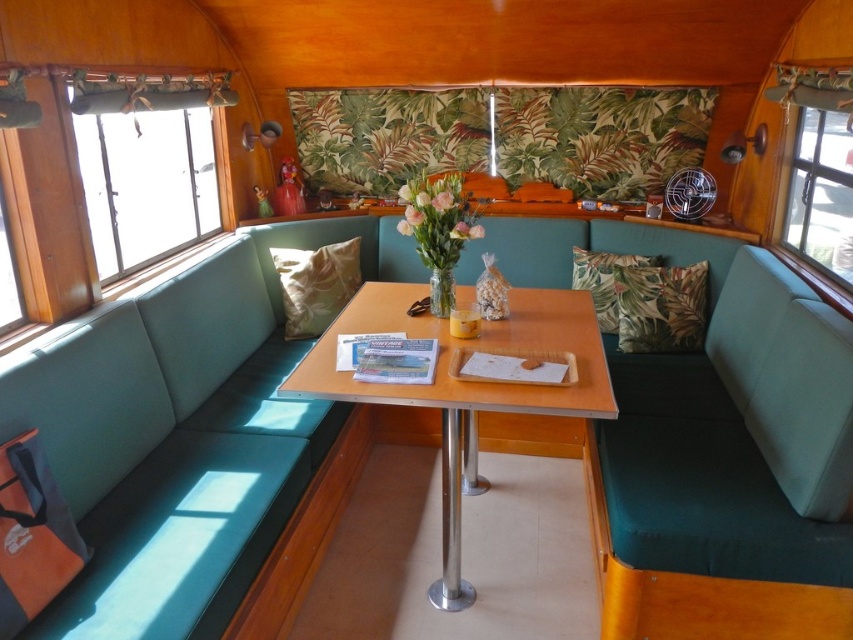
Does teal fabric couch at left have a lesser width compared to translucent glass vase at center?

No.

Is teal fabric couch at left further to the viewer compared to translucent glass vase at center?

No.

Does point (149, 573) lie in front of point (416, 225)?

Yes, point (149, 573) is in front of point (416, 225).

Find the location of a particular element. teal fabric couch at left is located at coordinates (178, 438).

Who is positioned more to the left, wooden table at center or green fabric pillow at center?

Positioned to the left is green fabric pillow at center.

Who is taller, wooden table at center or green fabric pillow at center?

With more height is wooden table at center.

The image size is (853, 640). What are the coordinates of `wooden table at center` in the screenshot? It's located at (466, 384).

Does point (573, 280) come closer to viewer compared to point (442, 300)?

No, (573, 280) is behind (442, 300).

Is floral fabric pillow at center positioned in front of clear glass vase at center?

No, floral fabric pillow at center is behind clear glass vase at center.

The width and height of the screenshot is (853, 640). What do you see at coordinates (604, 280) in the screenshot? I see `floral fabric pillow at center` at bounding box center [604, 280].

The height and width of the screenshot is (640, 853). I want to click on floral fabric pillow at center, so click(x=604, y=280).